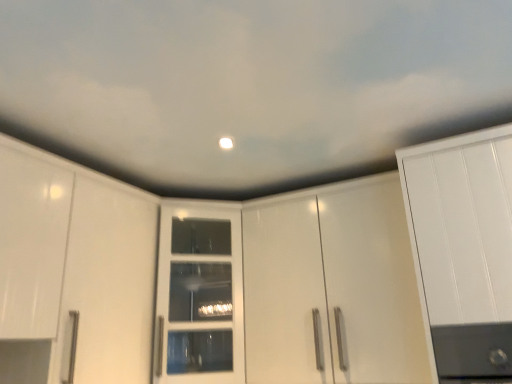
Question: Is glossy white cabinet at center beside white glossy cabinet door at center?

Choices:
 (A) yes
 (B) no

Answer: (B)

Question: Considering the relative positions of glossy white cabinet at center and white glossy cabinet door at center in the image provided, is glossy white cabinet at center to the right of white glossy cabinet door at center from the viewer's perspective?

Choices:
 (A) no
 (B) yes

Answer: (B)

Question: Does glossy white cabinet at center have a smaller size compared to white glossy cabinet door at center?

Choices:
 (A) no
 (B) yes

Answer: (A)

Question: Does glossy white cabinet at center have a lesser width compared to white glossy cabinet door at center?

Choices:
 (A) no
 (B) yes

Answer: (B)

Question: Is glossy white cabinet at center wider than white glossy cabinet door at center?

Choices:
 (A) yes
 (B) no

Answer: (B)

Question: Considering the relative positions of glossy white cabinet at center and white glossy cabinet door at center in the image provided, is glossy white cabinet at center behind white glossy cabinet door at center?

Choices:
 (A) no
 (B) yes

Answer: (A)

Question: Is white glossy cabinet door at center facing towards glossy white cabinet at center?

Choices:
 (A) yes
 (B) no

Answer: (B)

Question: Is white glossy cabinet door at center wider than glossy white cabinet at center?

Choices:
 (A) yes
 (B) no

Answer: (A)

Question: Does white glossy cabinet door at center have a larger size compared to glossy white cabinet at center?

Choices:
 (A) no
 (B) yes

Answer: (A)

Question: Can you confirm if white glossy cabinet door at center is smaller than glossy white cabinet at center?

Choices:
 (A) yes
 (B) no

Answer: (A)

Question: Is white glossy cabinet door at center not close to glossy white cabinet at center?

Choices:
 (A) no
 (B) yes

Answer: (A)

Question: From a real-world perspective, is white glossy cabinet door at center located beneath glossy white cabinet at center?

Choices:
 (A) yes
 (B) no

Answer: (B)

Question: In terms of width, does white glossy cabinet door at center look wider or thinner when compared to glossy white cabinet at center?

Choices:
 (A) thin
 (B) wide

Answer: (B)